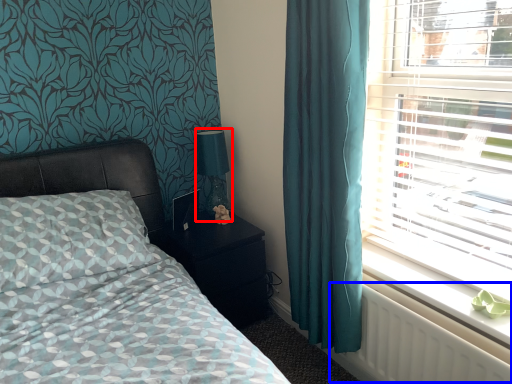
Question: Which object appears farthest to the camera in this image, table lamp (highlighted by a red box) or radiator (highlighted by a blue box)?

Choices:
 (A) table lamp
 (B) radiator

Answer: (A)